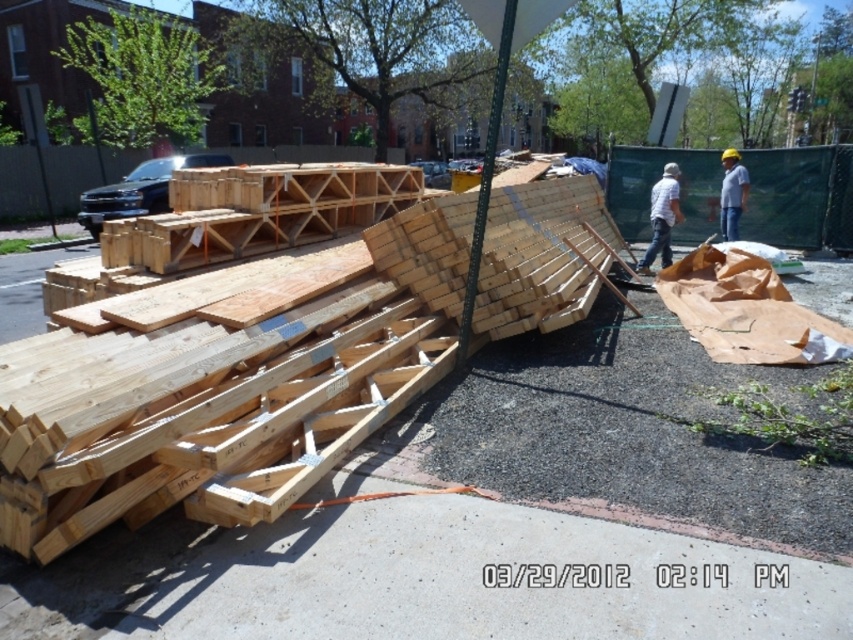
Question: Which object appears farthest from the camera in this image?

Choices:
 (A) white matte shirt at center
 (B) natural wood at center

Answer: (A)

Question: Is the position of natural wood at center less distant than that of white matte shirt at center?

Choices:
 (A) no
 (B) yes

Answer: (B)

Question: Among these objects, which one is farthest from the camera?

Choices:
 (A) natural wood boards at center
 (B) natural wood at center
 (C) white matte shirt at center

Answer: (C)

Question: Is natural wood at center further to the viewer compared to white matte shirt at center?

Choices:
 (A) yes
 (B) no

Answer: (B)

Question: Which object is farther from the camera taking this photo?

Choices:
 (A) natural wood boards at center
 (B) natural wood at center
 (C) white matte shirt at center

Answer: (C)

Question: Does natural wood boards at center have a lesser width compared to natural wood at center?

Choices:
 (A) yes
 (B) no

Answer: (A)